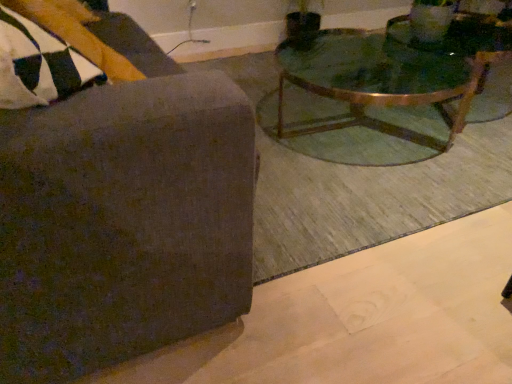
Question: Is dark gray fabric chair at upper left positioned far away from green glass coffee table at upper right?

Choices:
 (A) no
 (B) yes

Answer: (B)

Question: Considering the relative sizes of dark gray fabric chair at upper left and green glass coffee table at upper right in the image provided, is dark gray fabric chair at upper left smaller than green glass coffee table at upper right?

Choices:
 (A) yes
 (B) no

Answer: (A)

Question: From the image's perspective, is dark gray fabric chair at upper left located above green glass coffee table at upper right?

Choices:
 (A) no
 (B) yes

Answer: (A)

Question: Can we say dark gray fabric chair at upper left lies outside green glass coffee table at upper right?

Choices:
 (A) yes
 (B) no

Answer: (A)

Question: Is the surface of dark gray fabric chair at upper left in direct contact with green glass coffee table at upper right?

Choices:
 (A) yes
 (B) no

Answer: (B)

Question: Is dark gray fabric chair at upper left turned away from green glass coffee table at upper right?

Choices:
 (A) no
 (B) yes

Answer: (A)

Question: From a real-world perspective, does green glass coffee table at upper right sit lower than dark gray fabric chair at upper left?

Choices:
 (A) yes
 (B) no

Answer: (A)

Question: Is green glass coffee table at upper right facing away from dark gray fabric chair at upper left?

Choices:
 (A) no
 (B) yes

Answer: (A)

Question: Is dark gray fabric chair at upper left a part of green glass coffee table at upper right?

Choices:
 (A) yes
 (B) no

Answer: (B)

Question: Can you confirm if green glass coffee table at upper right is wider than dark gray fabric chair at upper left?

Choices:
 (A) no
 (B) yes

Answer: (B)

Question: Considering the relative sizes of green glass coffee table at upper right and dark gray fabric chair at upper left in the image provided, is green glass coffee table at upper right taller than dark gray fabric chair at upper left?

Choices:
 (A) yes
 (B) no

Answer: (B)

Question: Is green glass coffee table at upper right placed right next to dark gray fabric chair at upper left?

Choices:
 (A) yes
 (B) no

Answer: (B)

Question: Is green glass coffee table at upper right inside or outside of dark gray fabric chair at upper left?

Choices:
 (A) outside
 (B) inside

Answer: (A)